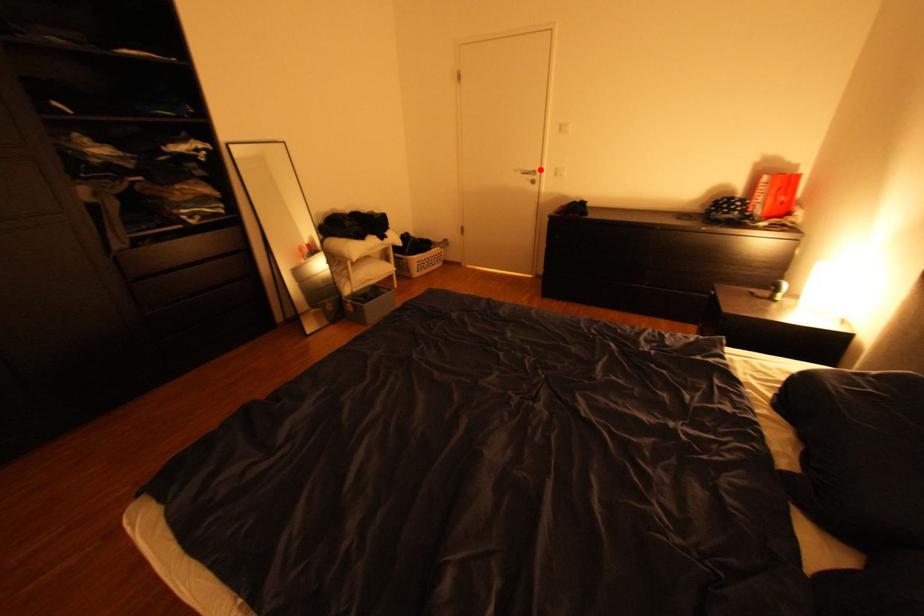
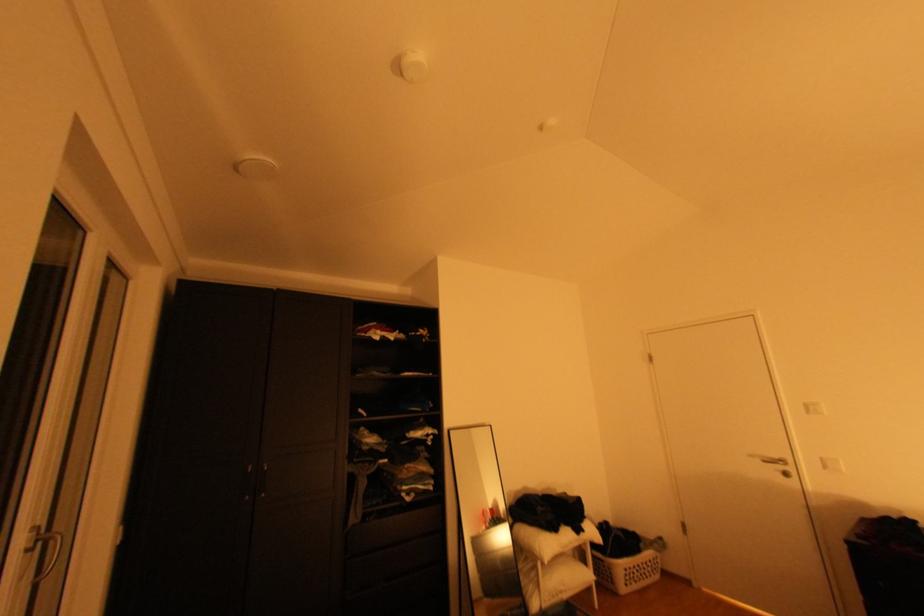
Locate, in the second image, the point that corresponds to the highlighted location in the first image.

(786, 456)